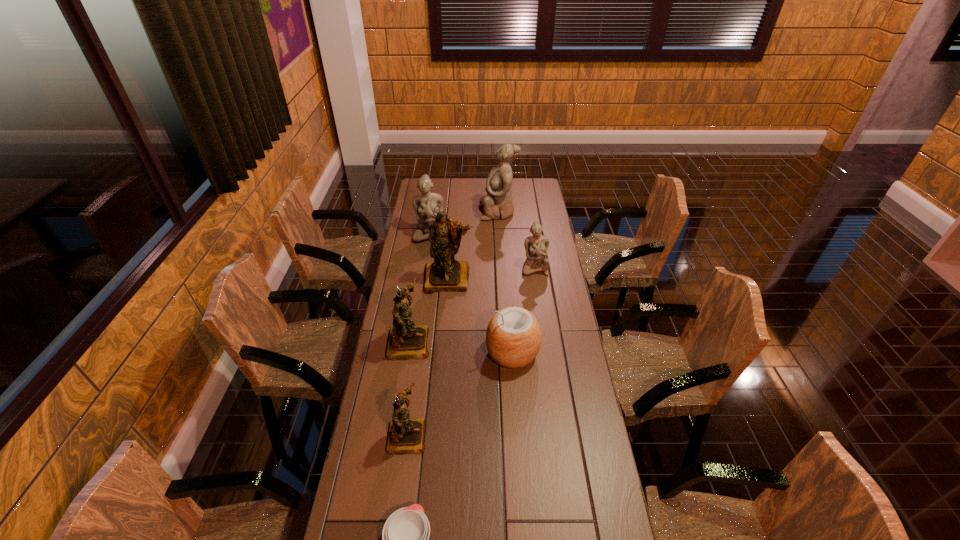
Locate an element on the screen. the farthest white figurine is located at coordinates (498, 203).

Find the location of a particular element. The width and height of the screenshot is (960, 540). the farthest figurine is located at coordinates (498, 203).

Find the location of a particular element. The height and width of the screenshot is (540, 960). the biggest gold figurine is located at coordinates (445, 274).

Where is `the second farthest figurine`? The image size is (960, 540). the second farthest figurine is located at coordinates (424, 203).

Identify the location of the second biggest white figurine. Image resolution: width=960 pixels, height=540 pixels. (424, 203).

What are the coordinates of `the second nearest gold figurine` in the screenshot? It's located at (406, 341).

Where is `the second smallest gold figurine`? The height and width of the screenshot is (540, 960). the second smallest gold figurine is located at coordinates (406, 341).

What are the coordinates of `coconut` in the screenshot? It's located at [x=513, y=337].

Where is `the smallest white figurine`? The height and width of the screenshot is (540, 960). the smallest white figurine is located at coordinates (536, 246).

This screenshot has height=540, width=960. What are the coordinates of `the smallest gold figurine` in the screenshot? It's located at (405, 435).